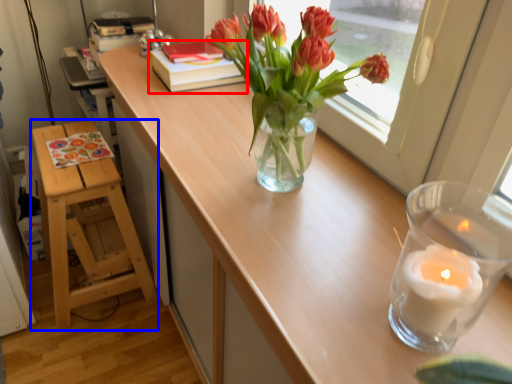
Question: Which of the following is the farthest to the observer, book (highlighted by a red box) or furniture (highlighted by a blue box)?

Choices:
 (A) book
 (B) furniture

Answer: (A)